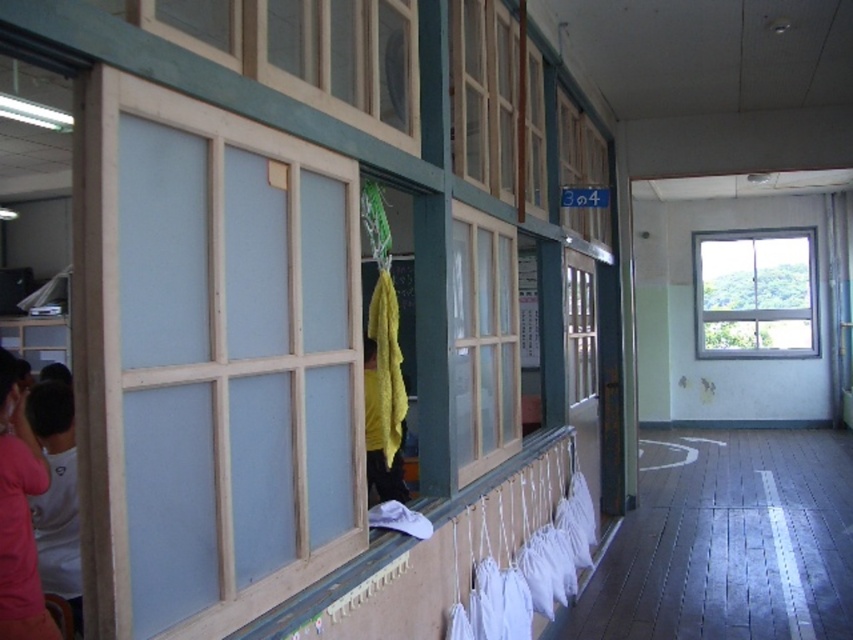
Question: Among these objects, which one is farthest from the camera?

Choices:
 (A) clear glass window at upper right
 (B) pink fabric at lower left
 (C) yellow fabric at center
 (D) clear glass window at center

Answer: (A)

Question: Does pink fabric at lower left appear under clear glass window at center?

Choices:
 (A) yes
 (B) no

Answer: (A)

Question: Considering the real-world distances, which object is farthest from the clear glass window at center?

Choices:
 (A) white cotton shirt at lower left
 (B) clear glass window at upper right
 (C) wooden frame window at center
 (D) light blue wood window at center

Answer: (B)

Question: Considering the real-world distances, which object is farthest from the yellow fabric at center?

Choices:
 (A) clear glass window at upper right
 (B) wooden frame window at center

Answer: (A)

Question: Is light blue wood window at center bigger than yellow fabric at center?

Choices:
 (A) no
 (B) yes

Answer: (A)

Question: Does wooden frame window at center appear on the right side of pink fabric at lower left?

Choices:
 (A) no
 (B) yes

Answer: (B)